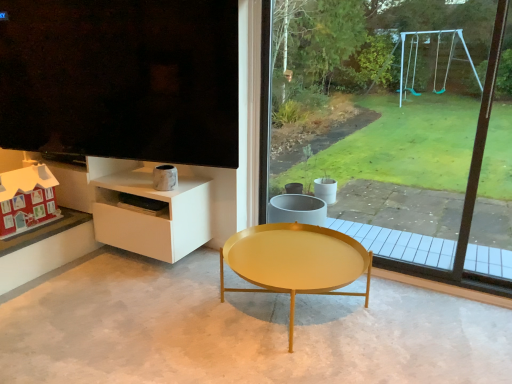
Image resolution: width=512 pixels, height=384 pixels. I want to click on vacant point to the left of gold metallic coffee table at center, so click(162, 311).